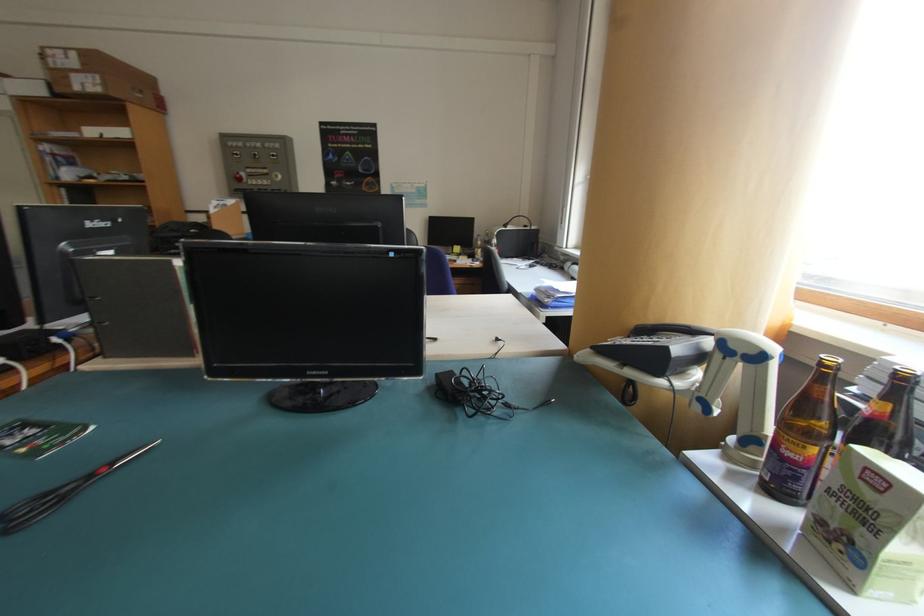
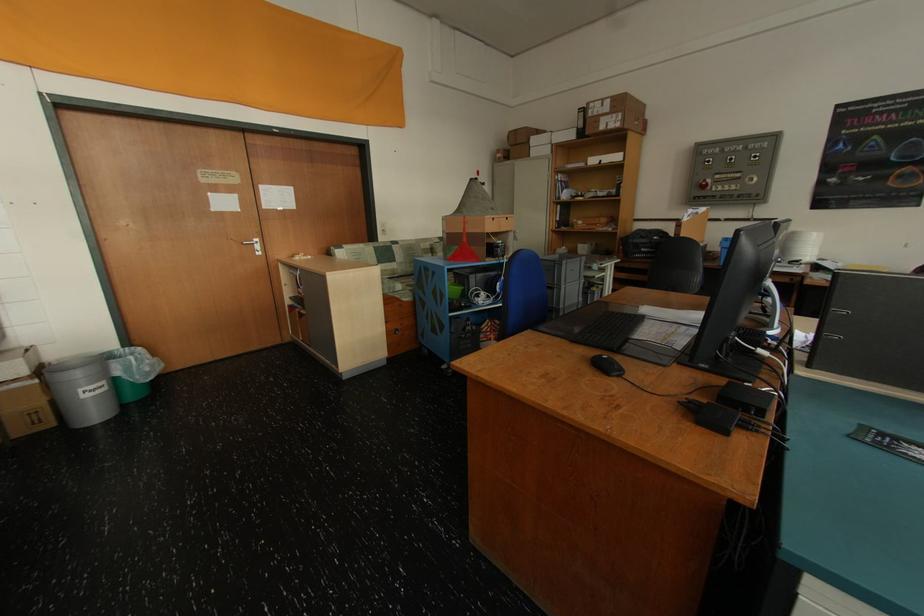
Find the pixel in the second image that matches (106,81) in the first image.

(628, 118)